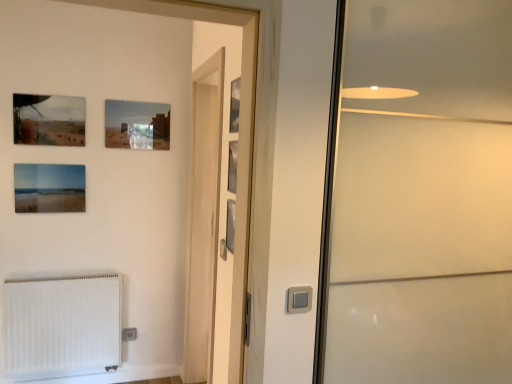
Question: From the image's perspective, is transparent glass screen door at right, which appears as the first screen door when viewed from the right, over metallic silver picture frame at upper center, which is the 6th picture frame from back to front?

Choices:
 (A) no
 (B) yes

Answer: (A)

Question: Does transparent glass screen door at right, the 2th screen door viewed from the left, have a lesser width compared to metallic silver picture frame at upper center, which is the 6th picture frame from back to front?

Choices:
 (A) no
 (B) yes

Answer: (A)

Question: Is transparent glass screen door at right, the 2th screen door viewed from the left, outside of metallic silver picture frame at upper center, the 6th picture frame when ordered from left to right?

Choices:
 (A) no
 (B) yes

Answer: (B)

Question: Considering the relative sizes of transparent glass screen door at right, the 2th screen door viewed from the left, and metallic silver picture frame at upper center, the 6th picture frame when ordered from left to right, in the image provided, is transparent glass screen door at right, the 2th screen door viewed from the left, bigger than metallic silver picture frame at upper center, the 6th picture frame when ordered from left to right,?

Choices:
 (A) yes
 (B) no

Answer: (A)

Question: Is transparent glass screen door at right, the 2th screen door viewed from the left, facing away from metallic silver picture frame at upper center, acting as the first picture frame starting from the front?

Choices:
 (A) no
 (B) yes

Answer: (A)

Question: From a real-world perspective, is metallic silver picture frame at upper center, which is the 6th picture frame from back to front, positioned above or below white plastic electric outlet at lower left?

Choices:
 (A) above
 (B) below

Answer: (A)

Question: From the image's perspective, is metallic silver picture frame at upper center, which is the 6th picture frame from back to front, located above or below white plastic electric outlet at lower left?

Choices:
 (A) above
 (B) below

Answer: (A)

Question: Considering their positions, is metallic silver picture frame at upper center, the 6th picture frame when ordered from left to right, located in front of or behind white plastic electric outlet at lower left?

Choices:
 (A) behind
 (B) front

Answer: (B)

Question: Considering the positions of point (x=234, y=102) and point (x=133, y=327), is point (x=234, y=102) closer or farther from the camera than point (x=133, y=327)?

Choices:
 (A) farther
 (B) closer

Answer: (B)

Question: Is wooden screen door at center, the 2th screen door viewed from the right, inside the boundaries of metallic silver picture frame at upper center, acting as the first picture frame starting from the front, or outside?

Choices:
 (A) inside
 (B) outside

Answer: (B)

Question: In terms of height, does wooden screen door at center, the 2th screen door viewed from the right, look taller or shorter compared to metallic silver picture frame at upper center, which is the 1th picture frame from right to left?

Choices:
 (A) short
 (B) tall

Answer: (B)

Question: From the image's perspective, is wooden screen door at center, the 2th screen door viewed from the right, positioned above or below metallic silver picture frame at upper center, which is the 6th picture frame from back to front?

Choices:
 (A) above
 (B) below

Answer: (B)

Question: Is wooden screen door at center, marked as the 1th screen door in a left-to-right arrangement, to the left or to the right of metallic silver picture frame at upper center, which is the 6th picture frame from back to front, in the image?

Choices:
 (A) right
 (B) left

Answer: (B)

Question: Choose the correct answer: Is metallic silver picture frame at upper center, acting as the first picture frame starting from the front, inside wooden screen door at center, the 2th screen door viewed from the right, or outside it?

Choices:
 (A) outside
 (B) inside

Answer: (A)

Question: Does point (236, 114) appear closer or farther from the camera than point (188, 203)?

Choices:
 (A) closer
 (B) farther

Answer: (A)